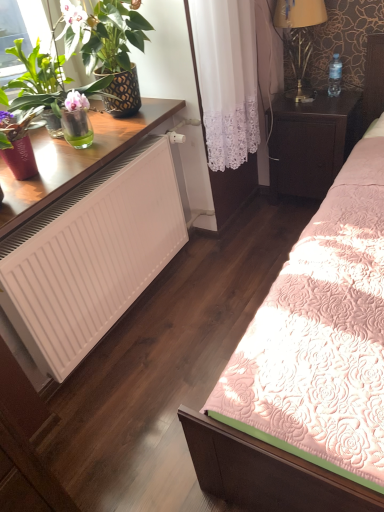
Question: Considering the relative sizes of gold metallic lamp at upper right and white matte radiator at lower left in the image provided, is gold metallic lamp at upper right thinner than white matte radiator at lower left?

Choices:
 (A) no
 (B) yes

Answer: (B)

Question: Is gold metallic lamp at upper right positioned behind white matte radiator at lower left?

Choices:
 (A) yes
 (B) no

Answer: (A)

Question: Is gold metallic lamp at upper right turned away from white matte radiator at lower left?

Choices:
 (A) no
 (B) yes

Answer: (A)

Question: Does gold metallic lamp at upper right have a lesser height compared to white matte radiator at lower left?

Choices:
 (A) yes
 (B) no

Answer: (A)

Question: Can you confirm if gold metallic lamp at upper right is bigger than white matte radiator at lower left?

Choices:
 (A) yes
 (B) no

Answer: (B)

Question: Could you tell me if gold metallic lamp at upper right is facing white matte radiator at lower left?

Choices:
 (A) no
 (B) yes

Answer: (A)

Question: Is white matte radiator at lower left thinner than gold metallic lamp at upper right?

Choices:
 (A) yes
 (B) no

Answer: (B)

Question: Is white matte radiator at lower left directly adjacent to gold metallic lamp at upper right?

Choices:
 (A) no
 (B) yes

Answer: (A)

Question: Can you confirm if white matte radiator at lower left is positioned to the left of gold metallic lamp at upper right?

Choices:
 (A) yes
 (B) no

Answer: (A)

Question: Considering the relative positions of white matte radiator at lower left and gold metallic lamp at upper right in the image provided, is white matte radiator at lower left to the right of gold metallic lamp at upper right from the viewer's perspective?

Choices:
 (A) yes
 (B) no

Answer: (B)

Question: Is white matte radiator at lower left looking in the opposite direction of gold metallic lamp at upper right?

Choices:
 (A) yes
 (B) no

Answer: (B)

Question: Does white matte radiator at lower left have a smaller size compared to gold metallic lamp at upper right?

Choices:
 (A) no
 (B) yes

Answer: (A)

Question: Is matte black pot at left at the back of pink floral quilt at center?

Choices:
 (A) yes
 (B) no

Answer: (B)